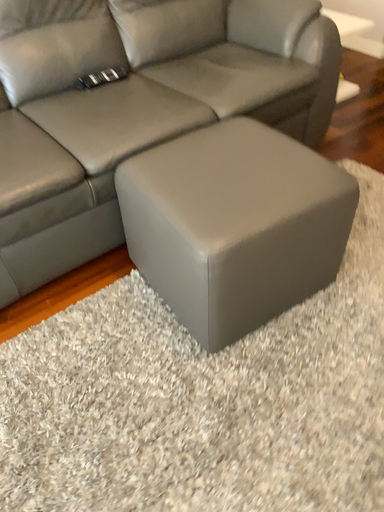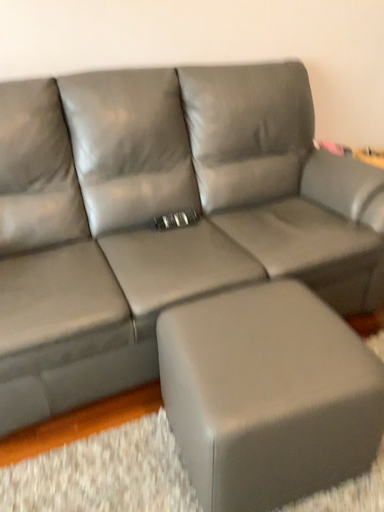
Question: How did the camera likely rotate when shooting the video?

Choices:
 (A) rotated downward
 (B) rotated upward

Answer: (B)